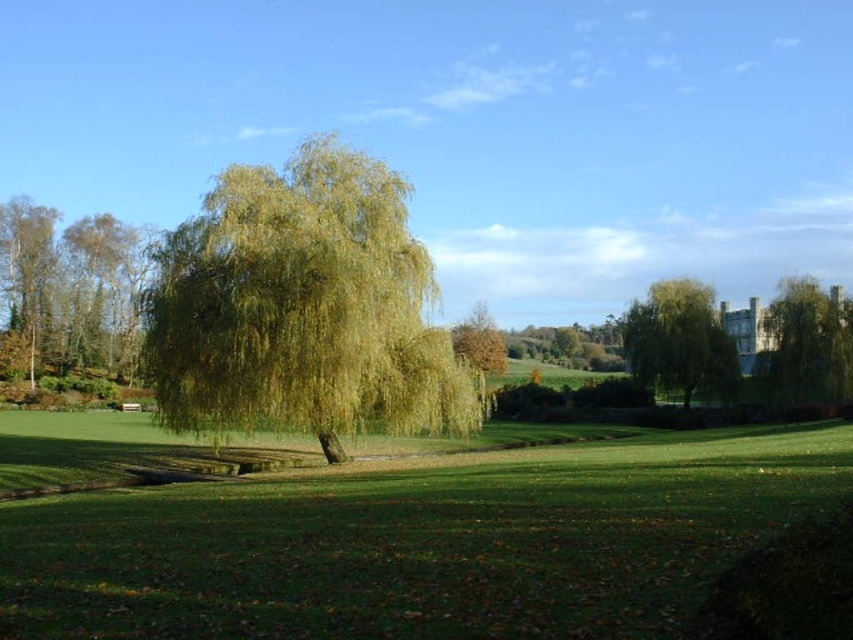
Is green leafy willow at center smaller than brown leafy tree at left?

Correct, green leafy willow at center occupies less space than brown leafy tree at left.

Is point (344, 428) positioned before point (44, 332)?

That is True.

Does point (260, 256) come farther from viewer compared to point (86, 326)?

No, (260, 256) is in front of (86, 326).

You are a GUI agent. You are given a task and a screenshot of the screen. Output one action in this format:
    pyautogui.click(x=<x>, y=<y>)
    Task: Click on the green leafy willow at center
    This screenshot has height=640, width=853.
    Given the screenshot: What is the action you would take?
    pyautogui.click(x=303, y=308)

Does smooth silver birch at left appear on the right side of brown leafy tree at center?

No, smooth silver birch at left is not to the right of brown leafy tree at center.

Looking at this image, is smooth silver birch at left behind brown leafy tree at center?

Yes.

Between point (33, 256) and point (462, 323), which one is positioned behind?

The point (462, 323) is more distant.

What are the coordinates of `smooth silver birch at left` in the screenshot? It's located at (26, 272).

Is green leafy tree at right further to the viewer compared to smooth silver birch at left?

That is False.

Is point (770, 348) positioned behind point (48, 234)?

No, it is in front of (48, 234).

At what (x,y) coordinates should I click in order to perform the action: click on green leafy tree at right. Please return your answer as a coordinate pair (x, y). Image resolution: width=853 pixels, height=640 pixels. Looking at the image, I should click on (807, 342).